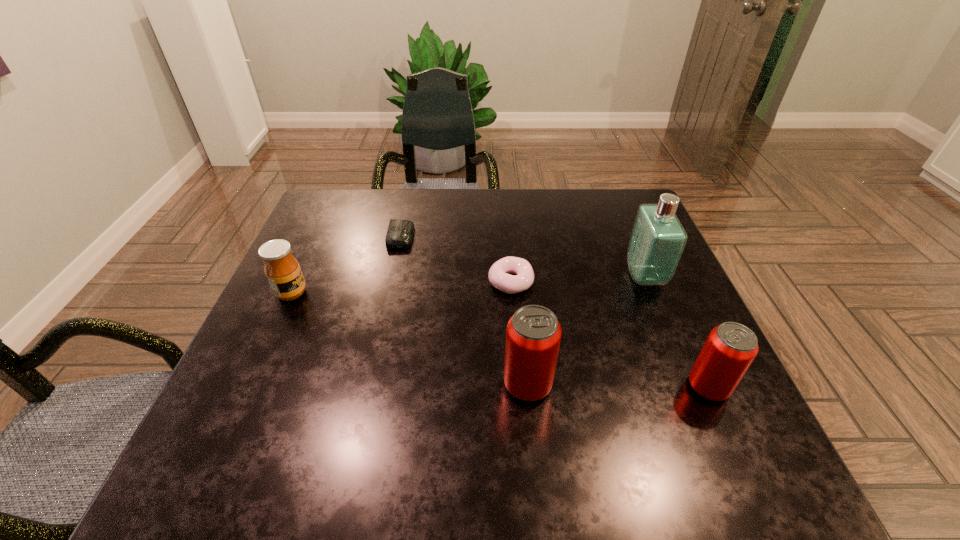
At what (x,y) coordinates should I click in order to perform the action: click on object that is at the near right corner. Please return your answer as a coordinate pair (x, y). Looking at the image, I should click on (731, 347).

Where is `vacant space at the far edge of the desktop`? Image resolution: width=960 pixels, height=540 pixels. vacant space at the far edge of the desktop is located at coordinates (514, 193).

Where is `free region at the near edge`? free region at the near edge is located at coordinates (320, 397).

Image resolution: width=960 pixels, height=540 pixels. Find the location of `vacant area at the left edge`. vacant area at the left edge is located at coordinates (287, 323).

The width and height of the screenshot is (960, 540). I want to click on vacant point at the right edge, so click(x=698, y=332).

You are a GUI agent. You are given a task and a screenshot of the screen. Output one action in this format:
    pyautogui.click(x=<x>, y=<y>)
    Task: Click on the vacant space at the far left corner of the desktop
    The height and width of the screenshot is (540, 960).
    Given the screenshot: What is the action you would take?
    pyautogui.click(x=335, y=192)

In the image, there is a desktop. At what (x,y) coordinates should I click in order to perform the action: click on vacant space at the near right corner. Please return your answer as a coordinate pair (x, y). Looking at the image, I should click on (674, 404).

What are the coordinates of `free space that is in between the shortest object and the tallest object` in the screenshot? It's located at (522, 256).

Where is `free space between the fifth shortest object and the perfume`? free space between the fifth shortest object and the perfume is located at coordinates point(586,330).

Where is `free space that is in between the tallest object and the fifth tallest object`? This screenshot has width=960, height=540. free space that is in between the tallest object and the fifth tallest object is located at coordinates (578, 279).